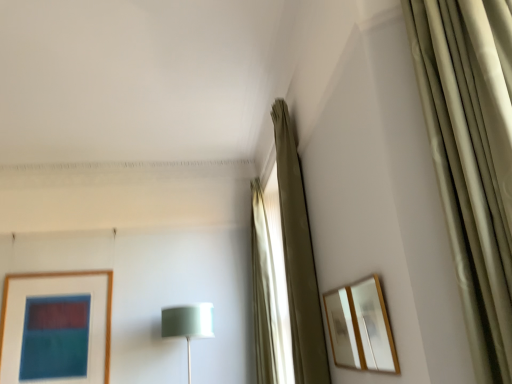
Question: Should I look upward or downward to see wooden-framed mirror at right, the first picture frame positioned from the front?

Choices:
 (A) up
 (B) down

Answer: (B)

Question: Is satin green shade at center far away from wooden-framed mirror at right, the first picture frame positioned from the front?

Choices:
 (A) yes
 (B) no

Answer: (A)

Question: From the image's perspective, would you say satin green shade at center is shown under wooden-framed mirror at right, the first picture frame positioned from the front?

Choices:
 (A) yes
 (B) no

Answer: (A)

Question: Does satin green shade at center lie behind wooden-framed mirror at right, the second picture frame positioned from the back?

Choices:
 (A) no
 (B) yes

Answer: (B)

Question: From a real-world perspective, does satin green shade at center stand above wooden-framed mirror at right, the second picture frame positioned from the back?

Choices:
 (A) yes
 (B) no

Answer: (B)

Question: Could you tell me if satin green shade at center is turned towards wooden-framed mirror at right, the first picture frame positioned from the front?

Choices:
 (A) yes
 (B) no

Answer: (B)

Question: Is satin green shade at center oriented away from wooden-framed mirror at right, the first picture frame positioned from the front?

Choices:
 (A) no
 (B) yes

Answer: (A)

Question: Considering the relative positions of wooden mirror at upper right, which is the 1th picture frame from back to front, and satin green shade at center in the image provided, is wooden mirror at upper right, which is the 1th picture frame from back to front, to the left of satin green shade at center from the viewer's perspective?

Choices:
 (A) yes
 (B) no

Answer: (B)

Question: Is wooden mirror at upper right, arranged as the 2th picture frame when viewed from the front, in front of satin green shade at center?

Choices:
 (A) yes
 (B) no

Answer: (A)

Question: Is wooden mirror at upper right, which is the 1th picture frame from back to front, aimed at satin green shade at center?

Choices:
 (A) yes
 (B) no

Answer: (B)

Question: Is wooden mirror at upper right, arranged as the 2th picture frame when viewed from the front, in contact with satin green shade at center?

Choices:
 (A) no
 (B) yes

Answer: (A)

Question: Is wooden mirror at upper right, arranged as the 2th picture frame when viewed from the front, looking in the opposite direction of satin green shade at center?

Choices:
 (A) yes
 (B) no

Answer: (B)

Question: From a real-world perspective, is wooden mirror at upper right, arranged as the 2th picture frame when viewed from the front, under satin green shade at center?

Choices:
 (A) no
 (B) yes

Answer: (A)

Question: Can you confirm if satin green shade at center is wider than beige fabric curtain at center, which ranks as the 1th curtain in back-to-front order?

Choices:
 (A) no
 (B) yes

Answer: (B)